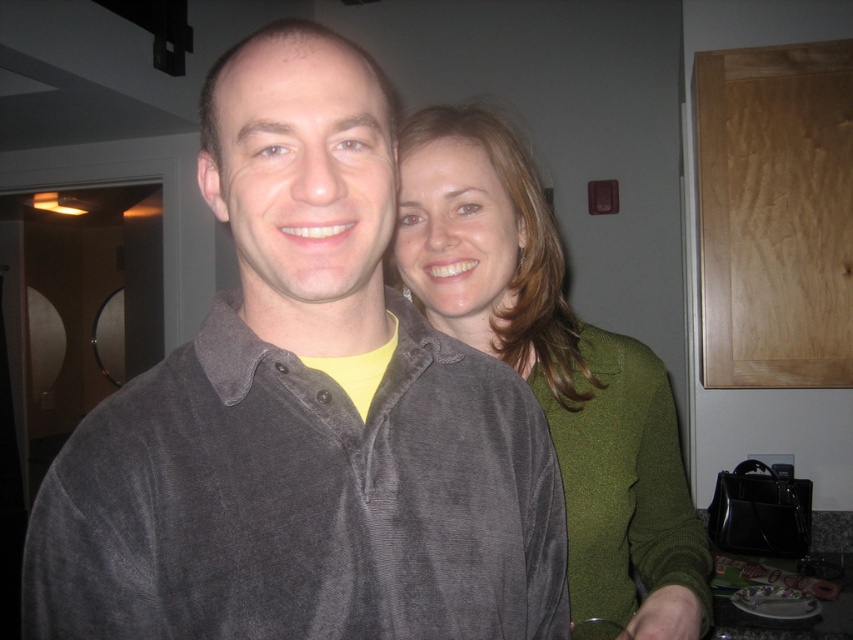
In the scene shown: Can you confirm if velvet gray shirt at center is wider than green velvety sweater at center?

In fact, velvet gray shirt at center might be narrower than green velvety sweater at center.

The image size is (853, 640). Identify the location of velvet gray shirt at center. (303, 413).